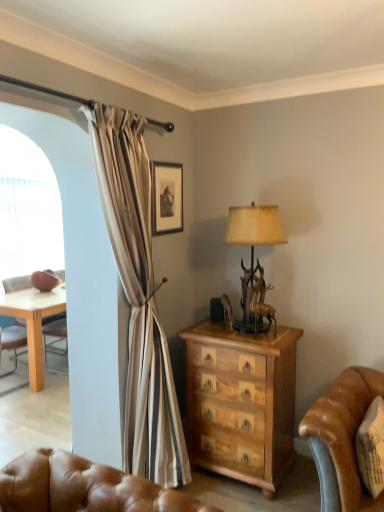
Question: From a real-world perspective, is wooden chest of drawers at center physically above antique brass lamp at center?

Choices:
 (A) no
 (B) yes

Answer: (A)

Question: Is the position of wooden chest of drawers at center more distant than that of antique brass lamp at center?

Choices:
 (A) no
 (B) yes

Answer: (A)

Question: Is wooden chest of drawers at center bigger than antique brass lamp at center?

Choices:
 (A) yes
 (B) no

Answer: (A)

Question: Is wooden chest of drawers at center to the right of antique brass lamp at center from the viewer's perspective?

Choices:
 (A) no
 (B) yes

Answer: (A)

Question: Is wooden chest of drawers at center thinner than antique brass lamp at center?

Choices:
 (A) yes
 (B) no

Answer: (B)

Question: Is wooden chest of drawers at center at the left side of antique brass lamp at center?

Choices:
 (A) no
 (B) yes

Answer: (B)

Question: Does antique brass lamp at center appear on the left side of matte black picture frame at upper center?

Choices:
 (A) yes
 (B) no

Answer: (B)

Question: Considering the relative sizes of antique brass lamp at center and matte black picture frame at upper center in the image provided, is antique brass lamp at center smaller than matte black picture frame at upper center?

Choices:
 (A) no
 (B) yes

Answer: (A)

Question: Can you confirm if antique brass lamp at center is thinner than matte black picture frame at upper center?

Choices:
 (A) no
 (B) yes

Answer: (A)

Question: From a real-world perspective, is antique brass lamp at center beneath matte black picture frame at upper center?

Choices:
 (A) no
 (B) yes

Answer: (B)

Question: Is antique brass lamp at center not close to matte black picture frame at upper center?

Choices:
 (A) no
 (B) yes

Answer: (A)

Question: Does antique brass lamp at center come in front of matte black picture frame at upper center?

Choices:
 (A) no
 (B) yes

Answer: (B)

Question: Is transparent plastic screen at left next to antique brass lamp at center and touching it?

Choices:
 (A) yes
 (B) no

Answer: (B)